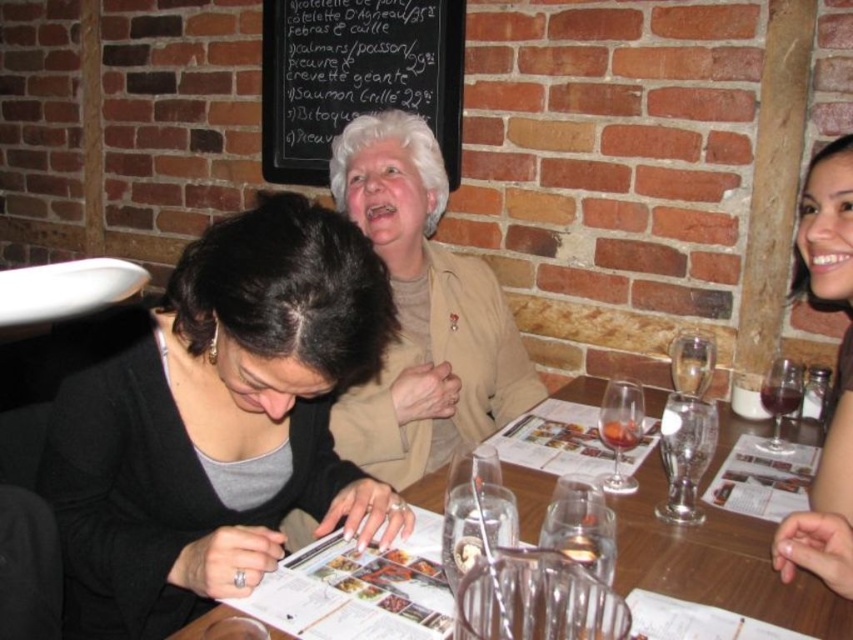
Measure the distance from clear glass wine glass at table center to translucent glass wine glass at center.

They are 2.93 inches apart.

Which is behind, point (691, 483) or point (642, 424)?

Positioned behind is point (642, 424).

Identify the location of clear glass wine glass at table center. Image resolution: width=853 pixels, height=640 pixels. (685, 454).

Is point (312, 68) positioned in front of point (630, 436)?

No, (312, 68) is behind (630, 436).

Is black chalkboard at upper center to the right of translucent glass wine glass at center from the viewer's perspective?

Incorrect, black chalkboard at upper center is not on the right side of translucent glass wine glass at center.

Does point (456, 84) lie in front of point (622, 436)?

That is False.

The width and height of the screenshot is (853, 640). In order to click on black chalkboard at upper center in this screenshot , I will do `click(355, 76)`.

Who is shorter, translucent glass wine glass at center or translucent glass wine at upper right?

Standing shorter between the two is translucent glass wine at upper right.

Describe the element at coordinates (619, 429) in the screenshot. I see `translucent glass wine glass at center` at that location.

What are the coordinates of `translucent glass wine glass at center` in the screenshot? It's located at (619, 429).